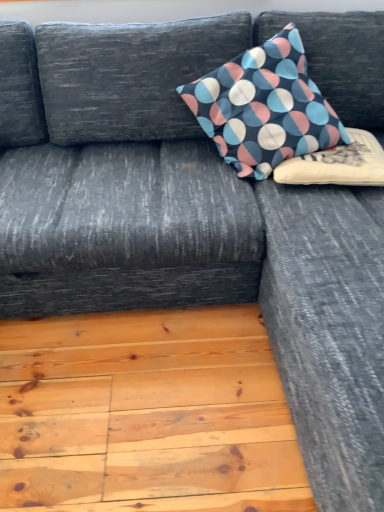
I want to click on soft cotton cushion at upper right, the 1th pillow in the bottom-to-top sequence, so click(337, 164).

In the scene shown: What is the approximate width of soft cotton cushion at upper right, the 2th pillow when ordered from top to bottom?

The width of soft cotton cushion at upper right, the 2th pillow when ordered from top to bottom, is 17.01 inches.

Describe the element at coordinates (337, 164) in the screenshot. I see `soft cotton cushion at upper right, the 2th pillow when ordered from top to bottom` at that location.

What do you see at coordinates (264, 106) in the screenshot? I see `patterned fabric pillow at upper center, positioned as the 1th pillow in top-to-bottom order` at bounding box center [264, 106].

The height and width of the screenshot is (512, 384). In order to click on patterned fabric pillow at upper center, positioned as the 1th pillow in top-to-bottom order in this screenshot , I will do `click(264, 106)`.

This screenshot has height=512, width=384. Identify the location of soft cotton cushion at upper right, the 1th pillow in the bottom-to-top sequence. (337, 164).

Is soft cotton cushion at upper right, the 2th pillow when ordered from top to bottom, at the right side of patterned fabric pillow at upper center, the 2th pillow when ordered from bottom to top?

Correct, you'll find soft cotton cushion at upper right, the 2th pillow when ordered from top to bottom, to the right of patterned fabric pillow at upper center, the 2th pillow when ordered from bottom to top.

Is soft cotton cushion at upper right, the 1th pillow in the bottom-to-top sequence, behind patterned fabric pillow at upper center, positioned as the 1th pillow in top-to-bottom order?

Yes, soft cotton cushion at upper right, the 1th pillow in the bottom-to-top sequence, is further from the camera.

Which point is more forward, [324,176] or [272,112]?

The point [324,176] is in front.

From the image's perspective, is soft cotton cushion at upper right, the 2th pillow when ordered from top to bottom, under patterned fabric pillow at upper center, positioned as the 1th pillow in top-to-bottom order?

Correct, soft cotton cushion at upper right, the 2th pillow when ordered from top to bottom, appears lower than patterned fabric pillow at upper center, positioned as the 1th pillow in top-to-bottom order, in the image.

From a real-world perspective, is soft cotton cushion at upper right, the 1th pillow in the bottom-to-top sequence, positioned above or below patterned fabric pillow at upper center, the 2th pillow when ordered from bottom to top?

From a real-world perspective, soft cotton cushion at upper right, the 1th pillow in the bottom-to-top sequence, is physically below patterned fabric pillow at upper center, the 2th pillow when ordered from bottom to top.

Between soft cotton cushion at upper right, the 1th pillow in the bottom-to-top sequence, and patterned fabric pillow at upper center, positioned as the 1th pillow in top-to-bottom order, which one has larger width?

patterned fabric pillow at upper center, positioned as the 1th pillow in top-to-bottom order.

Who is taller, soft cotton cushion at upper right, the 2th pillow when ordered from top to bottom, or patterned fabric pillow at upper center, the 2th pillow when ordered from bottom to top?

patterned fabric pillow at upper center, the 2th pillow when ordered from bottom to top, is taller.

In the scene shown: Who is smaller, soft cotton cushion at upper right, the 1th pillow in the bottom-to-top sequence, or patterned fabric pillow at upper center, positioned as the 1th pillow in top-to-bottom order?

soft cotton cushion at upper right, the 1th pillow in the bottom-to-top sequence, is smaller.

Which is correct: soft cotton cushion at upper right, the 1th pillow in the bottom-to-top sequence, is inside patterned fabric pillow at upper center, positioned as the 1th pillow in top-to-bottom order, or outside of it?

soft cotton cushion at upper right, the 1th pillow in the bottom-to-top sequence, is enclosed within patterned fabric pillow at upper center, positioned as the 1th pillow in top-to-bottom order.

Is there a large distance between soft cotton cushion at upper right, the 1th pillow in the bottom-to-top sequence, and patterned fabric pillow at upper center, positioned as the 1th pillow in top-to-bottom order?

No.

Could you tell me if soft cotton cushion at upper right, the 2th pillow when ordered from top to bottom, is turned towards patterned fabric pillow at upper center, positioned as the 1th pillow in top-to-bottom order?

Yes, soft cotton cushion at upper right, the 2th pillow when ordered from top to bottom, faces towards patterned fabric pillow at upper center, positioned as the 1th pillow in top-to-bottom order.

How many degrees apart are the facing directions of soft cotton cushion at upper right, the 1th pillow in the bottom-to-top sequence, and patterned fabric pillow at upper center, positioned as the 1th pillow in top-to-bottom order?

They differ by 35.6 degrees in their facing directions.

How much distance is there between soft cotton cushion at upper right, the 1th pillow in the bottom-to-top sequence, and patterned fabric pillow at upper center, the 2th pillow when ordered from bottom to top?

soft cotton cushion at upper right, the 1th pillow in the bottom-to-top sequence, and patterned fabric pillow at upper center, the 2th pillow when ordered from bottom to top, are 7.19 inches apart.

I want to click on pillow that is below the patterned fabric pillow at upper center, positioned as the 1th pillow in top-to-bottom order (from the image's perspective), so click(337, 164).

Considering the positions of objects patterned fabric pillow at upper center, the 2th pillow when ordered from bottom to top, and soft cotton cushion at upper right, the 2th pillow when ordered from top to bottom, in the image provided, who is more to the left, patterned fabric pillow at upper center, the 2th pillow when ordered from bottom to top, or soft cotton cushion at upper right, the 2th pillow when ordered from top to bottom,?

patterned fabric pillow at upper center, the 2th pillow when ordered from bottom to top.

Considering the positions of objects patterned fabric pillow at upper center, the 2th pillow when ordered from bottom to top, and soft cotton cushion at upper right, the 2th pillow when ordered from top to bottom, in the image provided, who is in front, patterned fabric pillow at upper center, the 2th pillow when ordered from bottom to top, or soft cotton cushion at upper right, the 2th pillow when ordered from top to bottom,?

patterned fabric pillow at upper center, the 2th pillow when ordered from bottom to top, is in front.

Is point (251, 124) closer to viewer compared to point (369, 164)?

No, (251, 124) is behind (369, 164).

From the image's perspective, who appears lower, patterned fabric pillow at upper center, positioned as the 1th pillow in top-to-bottom order, or soft cotton cushion at upper right, the 1th pillow in the bottom-to-top sequence?

soft cotton cushion at upper right, the 1th pillow in the bottom-to-top sequence, appears lower in the image.

From the picture: From a real-world perspective, who is located lower, patterned fabric pillow at upper center, the 2th pillow when ordered from bottom to top, or soft cotton cushion at upper right, the 1th pillow in the bottom-to-top sequence?

soft cotton cushion at upper right, the 1th pillow in the bottom-to-top sequence, from a real-world perspective.

Considering the relative sizes of patterned fabric pillow at upper center, positioned as the 1th pillow in top-to-bottom order, and soft cotton cushion at upper right, the 2th pillow when ordered from top to bottom, in the image provided, is patterned fabric pillow at upper center, positioned as the 1th pillow in top-to-bottom order, thinner than soft cotton cushion at upper right, the 2th pillow when ordered from top to bottom,?

In fact, patterned fabric pillow at upper center, positioned as the 1th pillow in top-to-bottom order, might be wider than soft cotton cushion at upper right, the 2th pillow when ordered from top to bottom.

Considering the sizes of objects patterned fabric pillow at upper center, positioned as the 1th pillow in top-to-bottom order, and soft cotton cushion at upper right, the 1th pillow in the bottom-to-top sequence, in the image provided, who is shorter, patterned fabric pillow at upper center, positioned as the 1th pillow in top-to-bottom order, or soft cotton cushion at upper right, the 1th pillow in the bottom-to-top sequence,?

With less height is soft cotton cushion at upper right, the 1th pillow in the bottom-to-top sequence.

Considering the relative sizes of patterned fabric pillow at upper center, the 2th pillow when ordered from bottom to top, and soft cotton cushion at upper right, the 2th pillow when ordered from top to bottom, in the image provided, is patterned fabric pillow at upper center, the 2th pillow when ordered from bottom to top, bigger than soft cotton cushion at upper right, the 2th pillow when ordered from top to bottom,?

Yes.

Could soft cotton cushion at upper right, the 1th pillow in the bottom-to-top sequence, be considered to be inside patterned fabric pillow at upper center, positioned as the 1th pillow in top-to-bottom order?

Yes, patterned fabric pillow at upper center, positioned as the 1th pillow in top-to-bottom order, is surrounding soft cotton cushion at upper right, the 1th pillow in the bottom-to-top sequence.

Is patterned fabric pillow at upper center, the 2th pillow when ordered from bottom to top, positioned far away from soft cotton cushion at upper right, the 2th pillow when ordered from top to bottom?

No, there isn't a large distance between patterned fabric pillow at upper center, the 2th pillow when ordered from bottom to top, and soft cotton cushion at upper right, the 2th pillow when ordered from top to bottom.

Does patterned fabric pillow at upper center, the 2th pillow when ordered from bottom to top, turn towards soft cotton cushion at upper right, the 2th pillow when ordered from top to bottom?

Yes, patterned fabric pillow at upper center, the 2th pillow when ordered from bottom to top, is turned towards soft cotton cushion at upper right, the 2th pillow when ordered from top to bottom.

Can you tell me how much patterned fabric pillow at upper center, the 2th pillow when ordered from bottom to top, and soft cotton cushion at upper right, the 2th pillow when ordered from top to bottom, differ in facing direction?

The angle between the facing direction of patterned fabric pillow at upper center, the 2th pillow when ordered from bottom to top, and the facing direction of soft cotton cushion at upper right, the 2th pillow when ordered from top to bottom, is 35.6 degrees.

Where is `pillow lying above the soft cotton cushion at upper right, the 1th pillow in the bottom-to-top sequence (from the image's perspective)`? The image size is (384, 512). pillow lying above the soft cotton cushion at upper right, the 1th pillow in the bottom-to-top sequence (from the image's perspective) is located at coordinates tap(264, 106).

What are the coordinates of `pillow above the soft cotton cushion at upper right, the 1th pillow in the bottom-to-top sequence (from a real-world perspective)` in the screenshot? It's located at (264, 106).

Identify the location of pillow behind the patterned fabric pillow at upper center, the 2th pillow when ordered from bottom to top. Image resolution: width=384 pixels, height=512 pixels. (337, 164).